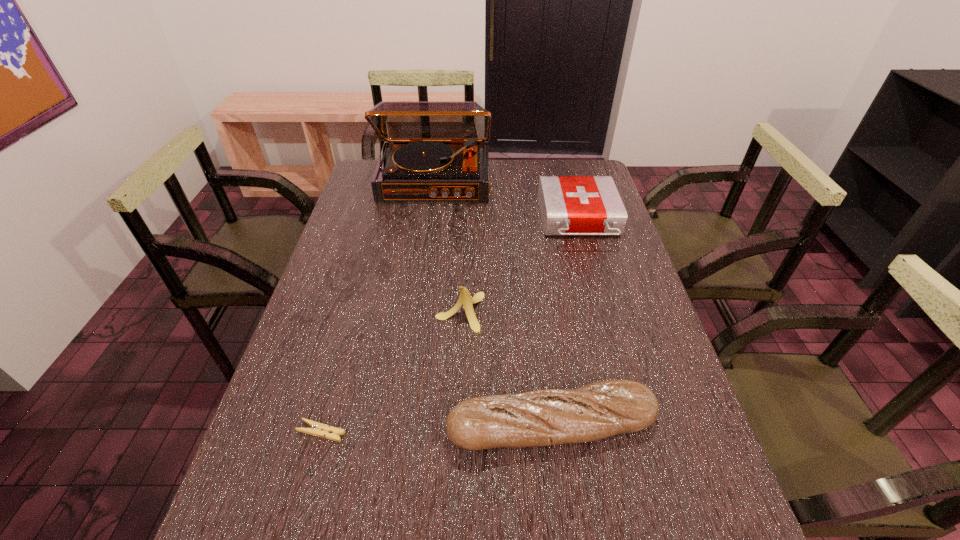
This screenshot has width=960, height=540. Identify the location of object that ranks as the third closest to the clothespin. (570, 205).

Point out which object is positioned as the nearest to the clothespin. Please provide its 2D coordinates. Your answer should be formatted as a tuple, i.e. [(x, y)], where the tuple contains the x and y coordinates of a point satisfying the conditions above.

[(598, 410)]

Locate an element on the screen. Image resolution: width=960 pixels, height=540 pixels. free point that satisfies the following two spatial constraints: 1. on the front-facing side of the tallest object; 2. on the right side of the baguet is located at coordinates (400, 425).

You are a GUI agent. You are given a task and a screenshot of the screen. Output one action in this format:
    pyautogui.click(x=<x>, y=<y>)
    Task: Click on the free point that satisfies the following two spatial constraints: 1. on the front-facing side of the baguet; 2. on the left side of the tallest object
    This screenshot has width=960, height=540.
    Given the screenshot: What is the action you would take?
    pos(400,425)

Locate an element on the screen. The width and height of the screenshot is (960, 540). vacant space that satisfies the following two spatial constraints: 1. on the back side of the third farthest object; 2. on the right side of the clothespin is located at coordinates pyautogui.click(x=354, y=313).